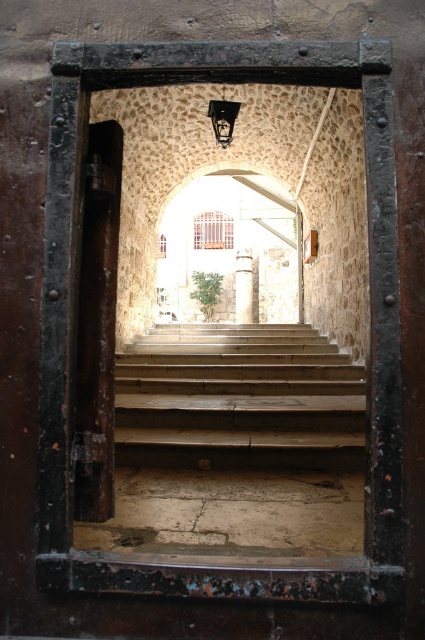
Between wooden stairs at center and rusty metal door at left, which one is positioned lower?

wooden stairs at center is below.

Is the position of wooden stairs at center more distant than that of rusty metal door at left?

Yes.

Is point (167, 330) positioned in front of point (87, 179)?

That is False.

This screenshot has height=640, width=425. Find the location of `wooden stairs at center`. wooden stairs at center is located at coordinates (238, 397).